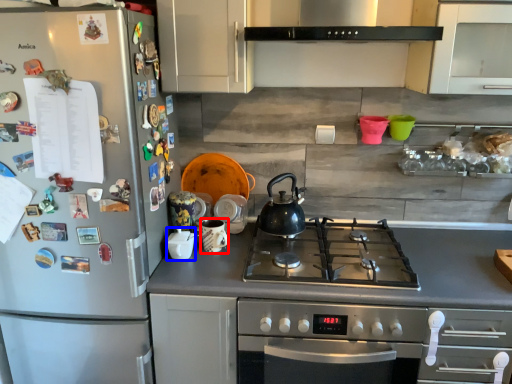
Question: Which object appears closest to the camera in this image, appliance (highlighted by a red box) or appliance (highlighted by a blue box)?

Choices:
 (A) appliance
 (B) appliance

Answer: (B)